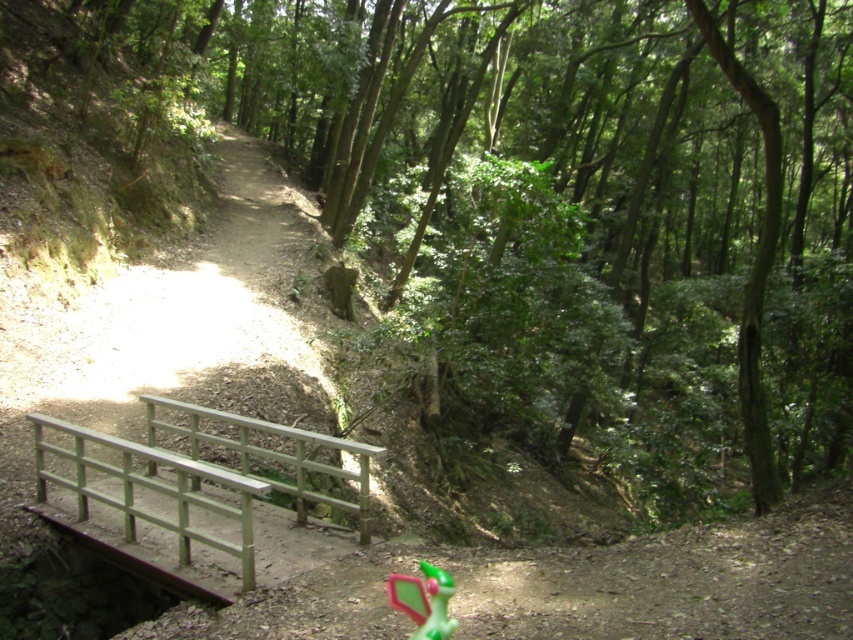
You are a hiker walking along the dirt path in the forest and you see the wooden bridge at lower left and the green matte toy at lower center. Which object is located above the other?

The wooden bridge at lower left is positioned over the green matte toy at lower center, so the wooden bridge at lower left is above the green matte toy at lower center.

You are a hiker carrying a backpack and looking at the green painted wood rail at lower center and the green matte toy at lower center on the forest path. Which object is wider?

The green painted wood rail at lower center might be wider than the green matte toy at lower center according to the description.